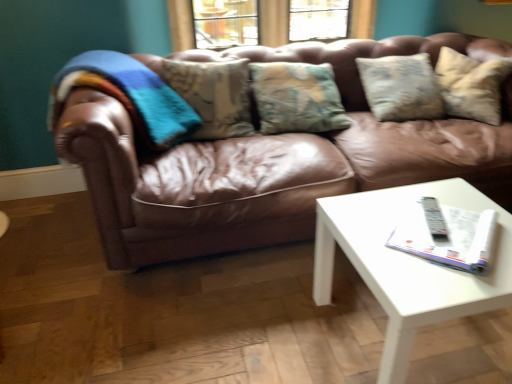
Question: Can you confirm if white glossy coffee table at lower right is thinner than brown leather couch at center?

Choices:
 (A) no
 (B) yes

Answer: (B)

Question: Is white glossy coffee table at lower right at the left side of brown leather couch at center?

Choices:
 (A) yes
 (B) no

Answer: (B)

Question: Can you confirm if white glossy coffee table at lower right is smaller than brown leather couch at center?

Choices:
 (A) yes
 (B) no

Answer: (A)

Question: Is white glossy coffee table at lower right behind brown leather couch at center?

Choices:
 (A) yes
 (B) no

Answer: (B)

Question: Are white glossy coffee table at lower right and brown leather couch at center located far from each other?

Choices:
 (A) yes
 (B) no

Answer: (B)

Question: Relative to brown leather couch at center, is white glossy coffee table at lower right in front or behind?

Choices:
 (A) front
 (B) behind

Answer: (A)

Question: Considering the positions of point 459,302 and point 227,178, is point 459,302 closer or farther from the camera than point 227,178?

Choices:
 (A) closer
 (B) farther

Answer: (A)

Question: From the image's perspective, is white glossy coffee table at lower right above or below brown leather couch at center?

Choices:
 (A) below
 (B) above

Answer: (A)

Question: In terms of width, does white glossy coffee table at lower right look wider or thinner when compared to brown leather couch at center?

Choices:
 (A) wide
 (B) thin

Answer: (B)

Question: Relative to white glossy coffee table at lower right, is white glossy magazine at center right in front or behind?

Choices:
 (A) front
 (B) behind

Answer: (B)

Question: From a real-world perspective, is white glossy magazine at center right above or below white glossy coffee table at lower right?

Choices:
 (A) below
 (B) above

Answer: (B)

Question: Is point (397, 233) closer or farther from the camera than point (463, 306)?

Choices:
 (A) closer
 (B) farther

Answer: (B)

Question: Looking at the image, does white glossy magazine at center right seem bigger or smaller compared to white glossy coffee table at lower right?

Choices:
 (A) small
 (B) big

Answer: (A)

Question: Is brown leather couch at center in front of or behind white glossy coffee table at lower right in the image?

Choices:
 (A) behind
 (B) front

Answer: (A)

Question: From the image's perspective, is brown leather couch at center above or below white glossy coffee table at lower right?

Choices:
 (A) above
 (B) below

Answer: (A)